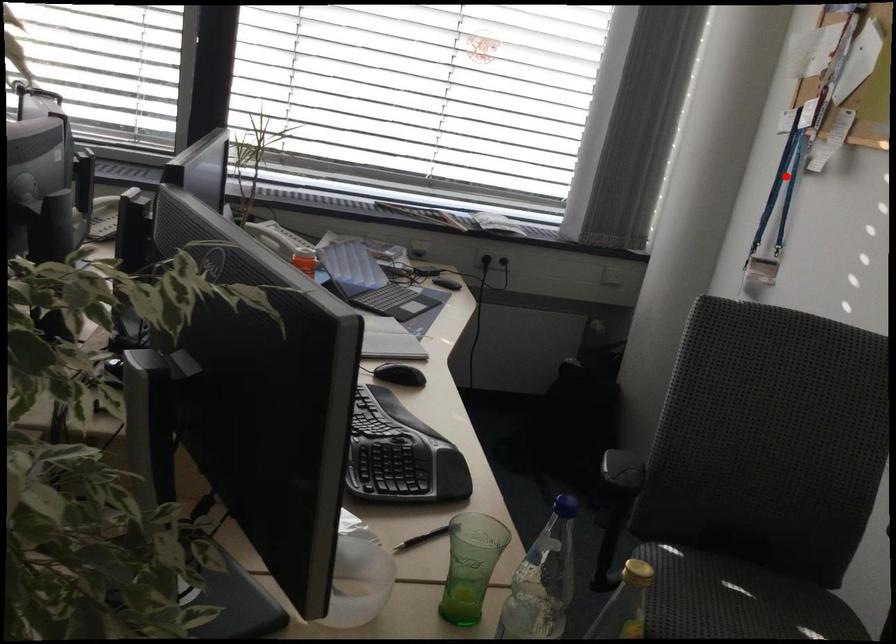
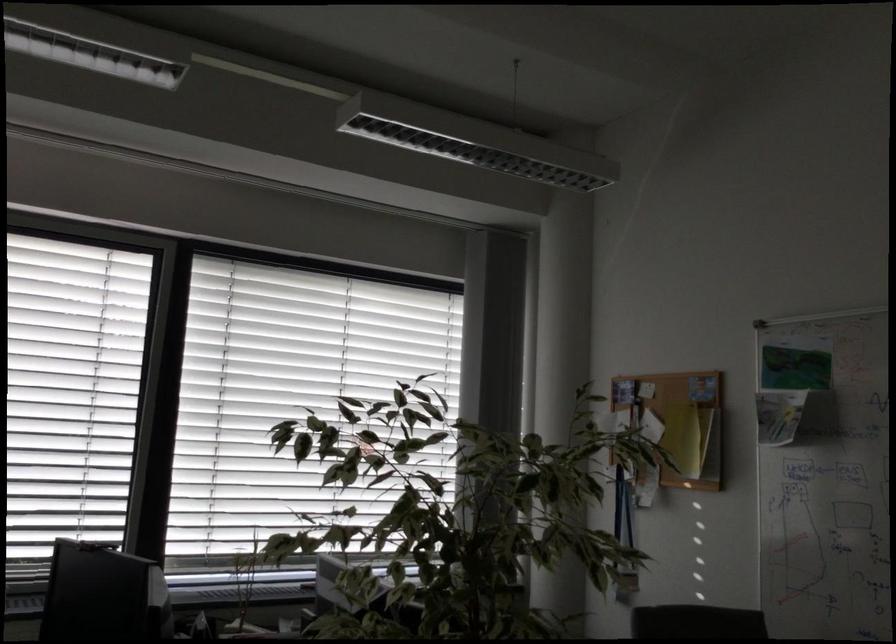
Question: I am providing you with two images of the same scene from different viewpoints. A red point is shown in image1. For the corresponding object point in image2, is it positioned nearer or farther from the camera?

Choices:
 (A) Nearer
 (B) Farther

Answer: (B)